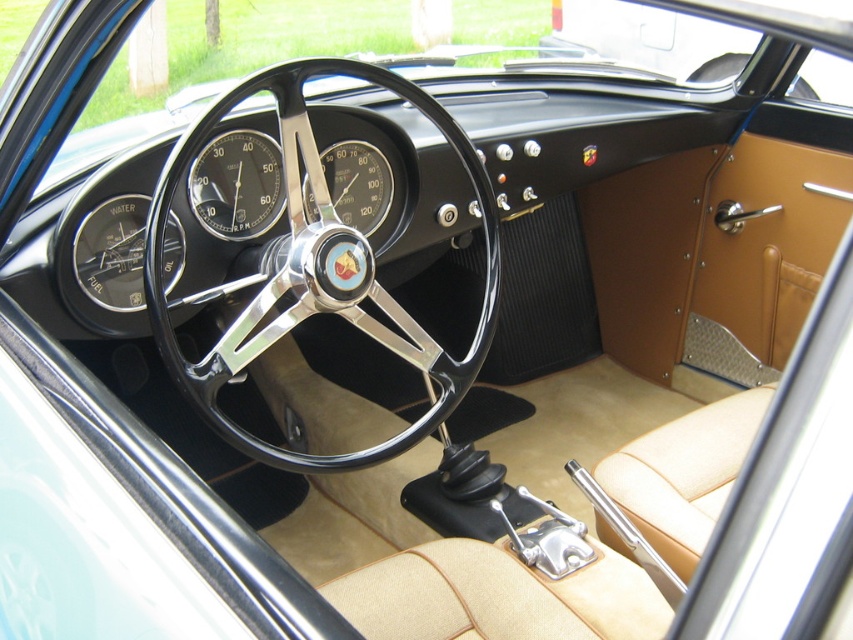
You are sitting in the driver seat of the vintage car. You notice a point marked at coordinates (x=236, y=184). What object is located at that point?

The point at coordinates (x=236, y=184) marks the matte black gauge at center.

You are sitting in the driver seat of the vintage car and want to check the RPM gauge. Since you can only see the RPM gauge if it is to the left of the black chrome steering wheel at center, is it visible to you?

The RPM gauge is located to the left of the black chrome steering wheel at center, so it is visible to you.